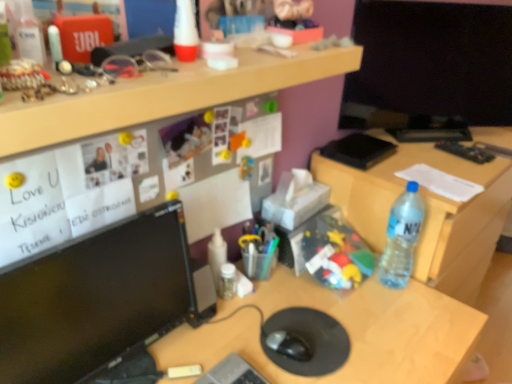
Find the location of `empty space that is to the right of black rubber mousepad at center`. empty space that is to the right of black rubber mousepad at center is located at coordinates (382, 334).